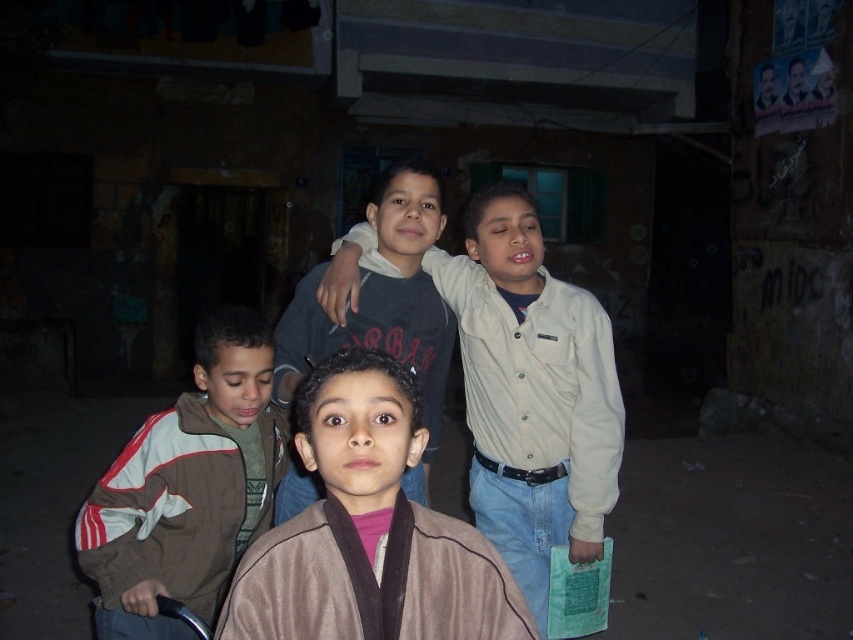
Is light beige shirt at center taller than brown suede jacket at center?

Yes.

This screenshot has width=853, height=640. In order to click on light beige shirt at center in this screenshot , I will do `click(531, 392)`.

In the scene shown: Who is more distant from viewer, [596,317] or [119,624]?

The point [596,317] is more distant.

Does light beige shirt at center have a greater width compared to brown fleece jacket at lower left?

Yes, light beige shirt at center is wider than brown fleece jacket at lower left.

Between point (540, 257) and point (172, 483), which one is positioned behind?

Point (540, 257)

Identify the location of light beige shirt at center. (531, 392).

Who is higher up, brown suede jacket at center or brown fleece jacket at lower left?

brown suede jacket at center

Which is more to the left, brown suede jacket at center or brown fleece jacket at lower left?

brown fleece jacket at lower left is more to the left.

Identify the location of brown suede jacket at center. (368, 531).